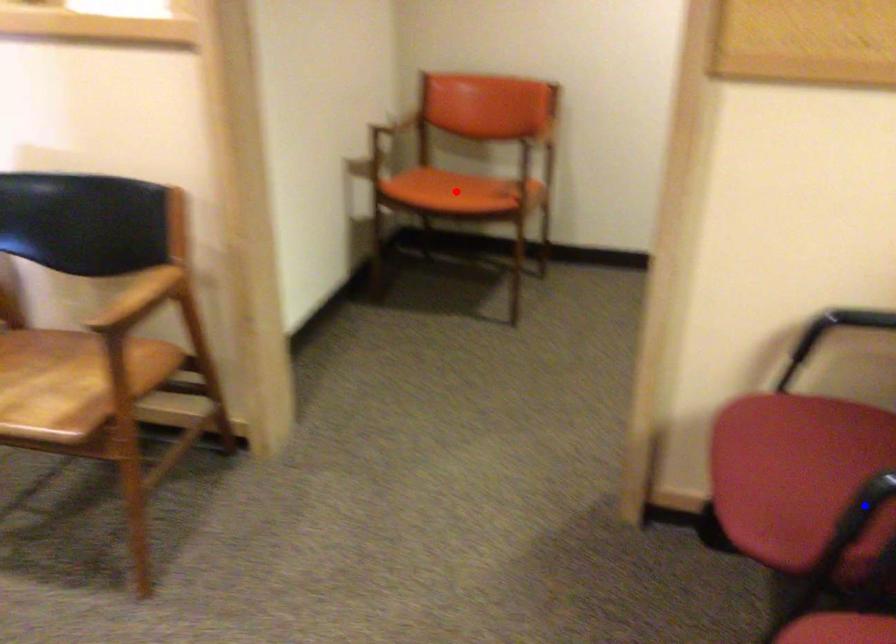
Question: In the image, two points are highlighted. Which point is nearer to the camera? Reply with the corresponding letter.

Choices:
 (A) blue point
 (B) red point

Answer: (A)